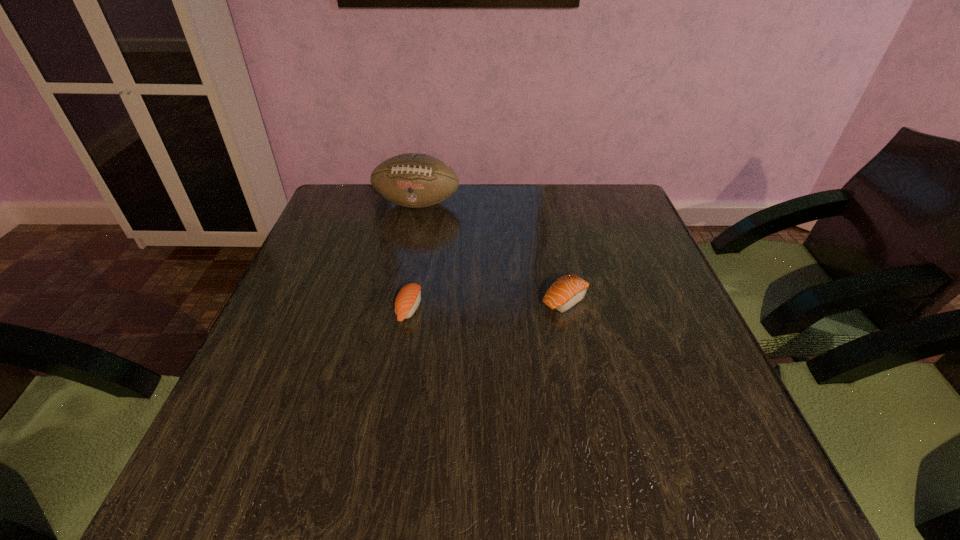
Identify the location of vacant area that lies between the tallest object and the right sushi. Image resolution: width=960 pixels, height=540 pixels. (492, 252).

This screenshot has height=540, width=960. Find the location of `unoccupied position between the farthest object and the right sushi`. unoccupied position between the farthest object and the right sushi is located at coordinates [x=492, y=252].

This screenshot has height=540, width=960. I want to click on free space between the left sushi and the right sushi, so click(487, 304).

This screenshot has width=960, height=540. I want to click on vacant space in between the tallest object and the left sushi, so click(413, 256).

Choose which object is the second nearest neighbor to the left sushi. Please provide its 2D coordinates. Your answer should be formatted as a tuple, i.e. [(x, y)], where the tuple contains the x and y coordinates of a point satisfying the conditions above.

[(413, 180)]

Identify the location of object that ranks as the closest to the left sushi. This screenshot has width=960, height=540. (568, 290).

Find the location of a particular element. The width and height of the screenshot is (960, 540). free spot that satisfies the following two spatial constraints: 1. on the laces of the farthest object; 2. on the right side of the left sushi is located at coordinates (396, 309).

I want to click on vacant area that satisfies the following two spatial constraints: 1. on the laces of the left sushi; 2. on the right side of the tallest object, so click(x=396, y=309).

Find the location of a particular element. The height and width of the screenshot is (540, 960). vacant area in the image that satisfies the following two spatial constraints: 1. on the laces of the left sushi; 2. on the right side of the farthest object is located at coordinates (396, 309).

Locate an element on the screen. The width and height of the screenshot is (960, 540). free spot that satisfies the following two spatial constraints: 1. on the laces of the left sushi; 2. on the left side of the football (American) is located at coordinates point(396,309).